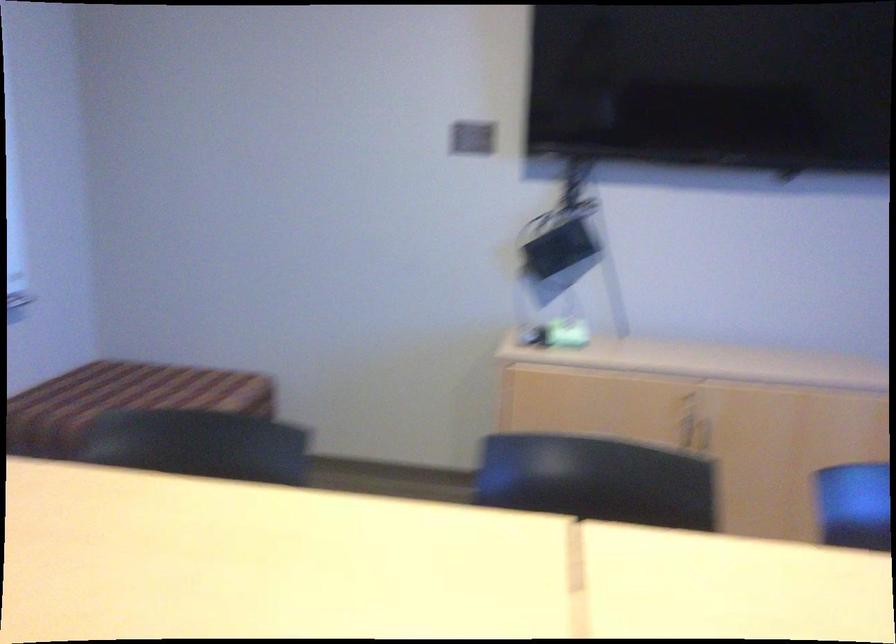
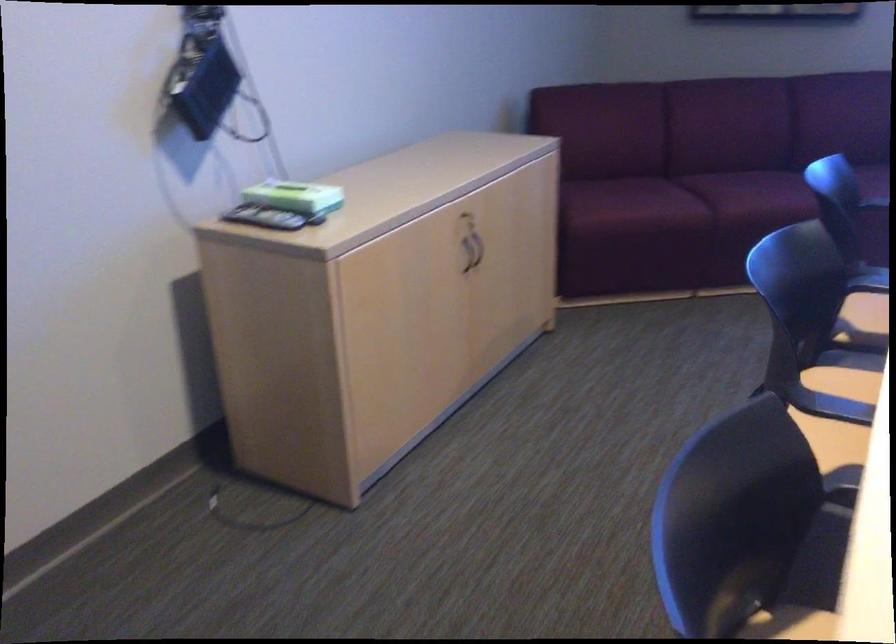
Where in the second image is the point corresponding to [683,438] from the first image?

(464, 259)